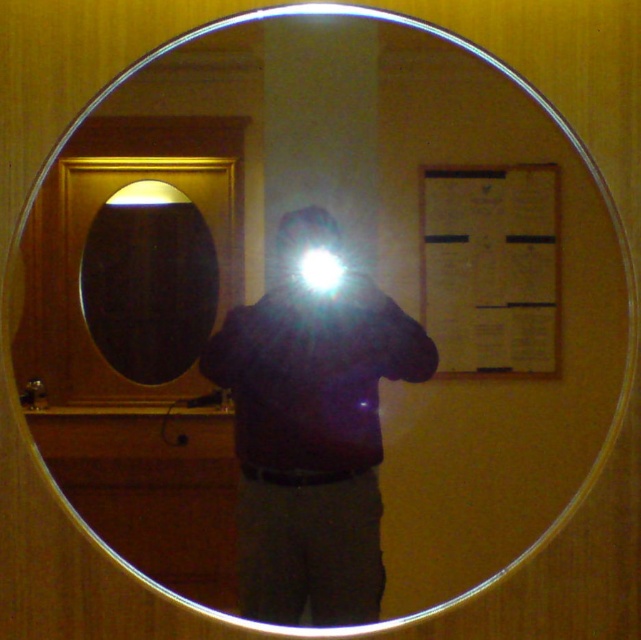
You are standing in a room with a dark matte jacket at center and a matte black oval mirror at left. You want to place a small plant between them so it is equally distant from both. Is this possible given their positions?

Yes, since the dark matte jacket at center is to the right of the matte black oval mirror at left, there is space between them to place the plant so it is equidistant from both.

You are a photographer trying to capture a self portrait in the bathroom. You notice the dark matte jacket at center and the matte black oval mirror at left. Which object in the scene is bigger?

The dark matte jacket at center is larger in size than the matte black oval mirror at left, so the dark matte jacket at center is bigger.

You are standing in front of the mirror holding a camera. You want to take a photo of yourself so that your dark matte jacket at center is clearly visible. The camera has a minimum focusing distance of 3 feet. Will you be able to take the photo without the jacket being blurry?

The distance between the dark matte jacket at center and the camera is 3.66 feet, which is greater than the camera minimum focusing distance of 3 feet. Therefore, you can take the photo and the jacket will be in focus.